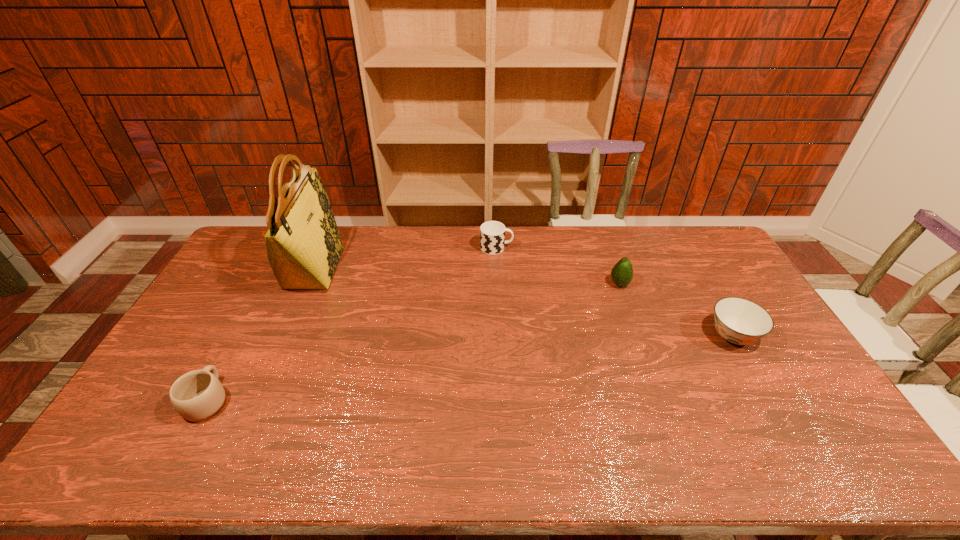
This screenshot has height=540, width=960. I want to click on vacant region located on the side of the nearest object with the handle, so click(252, 318).

Where is `free space located on the side of the nearest object with the handle`? Image resolution: width=960 pixels, height=540 pixels. free space located on the side of the nearest object with the handle is located at coordinates (233, 352).

Locate an element on the screen. vacant region located 0.070m on the front of the rightmost object is located at coordinates (756, 376).

Locate an element on the screen. The width and height of the screenshot is (960, 540). tote bag located at the far edge is located at coordinates (303, 244).

Find the location of a particular element. cup that is at the far edge is located at coordinates (492, 233).

Find the location of `object that is at the left edge`. object that is at the left edge is located at coordinates (198, 395).

At what (x,y) coordinates should I click in order to perform the action: click on object that is positioned at the right edge. Please return your answer as a coordinate pair (x, y). This screenshot has width=960, height=540. Looking at the image, I should click on (739, 321).

Find the location of a particular element. This screenshot has height=540, width=960. vacant space at the far edge of the desktop is located at coordinates (590, 227).

Locate an element on the screen. free region at the near edge of the desktop is located at coordinates (579, 461).

Locate an element on the screen. The height and width of the screenshot is (540, 960). vacant space at the right edge is located at coordinates (703, 271).